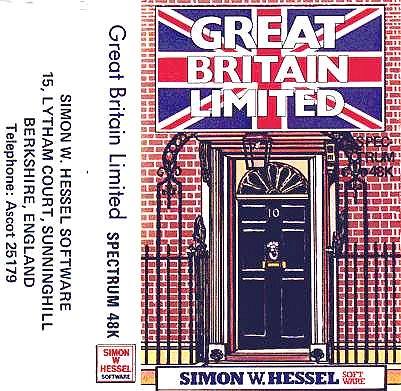
Locate an element on the screen. The image size is (401, 391). lantern is located at coordinates (253, 150).